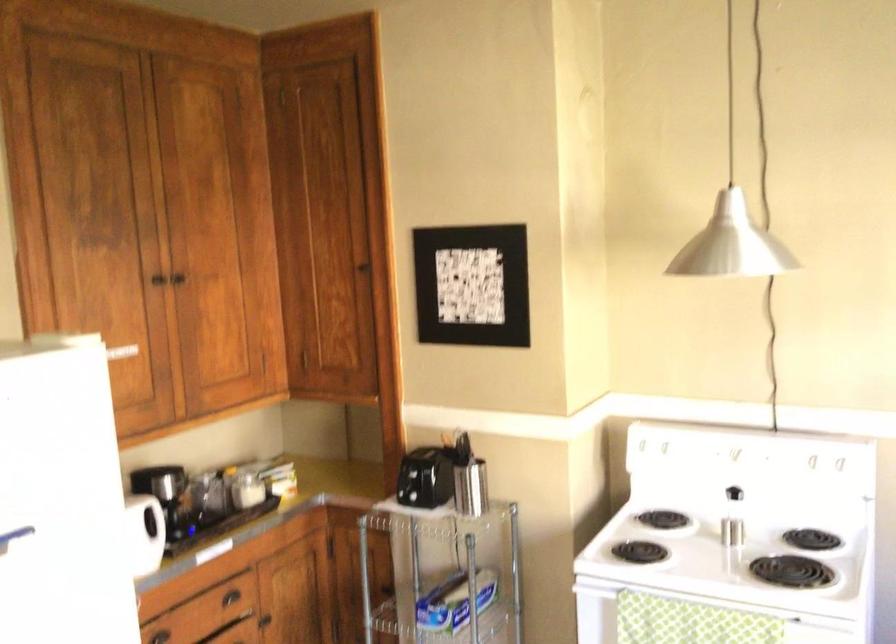
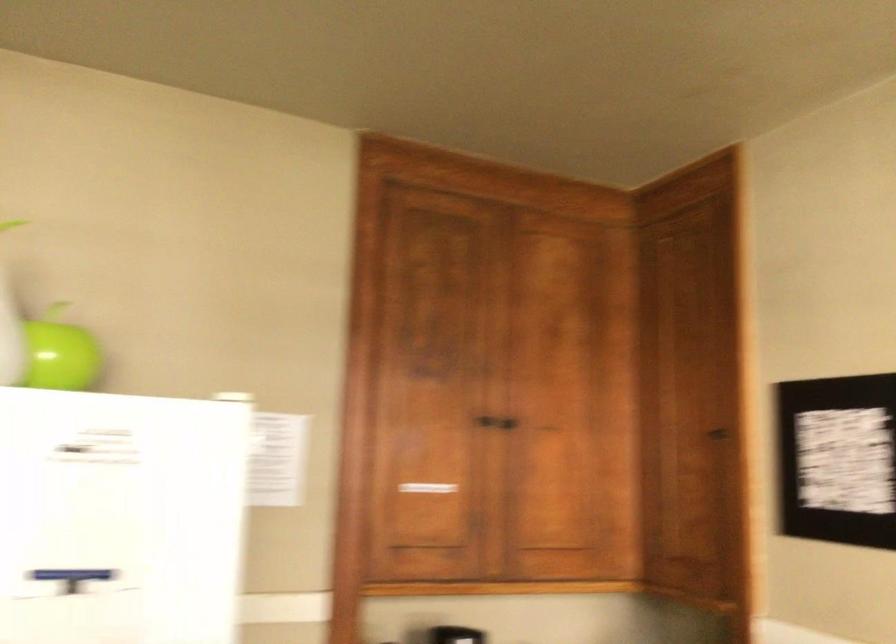
In the second image, find the point that corresponds to [368,266] in the first image.

(719, 436)